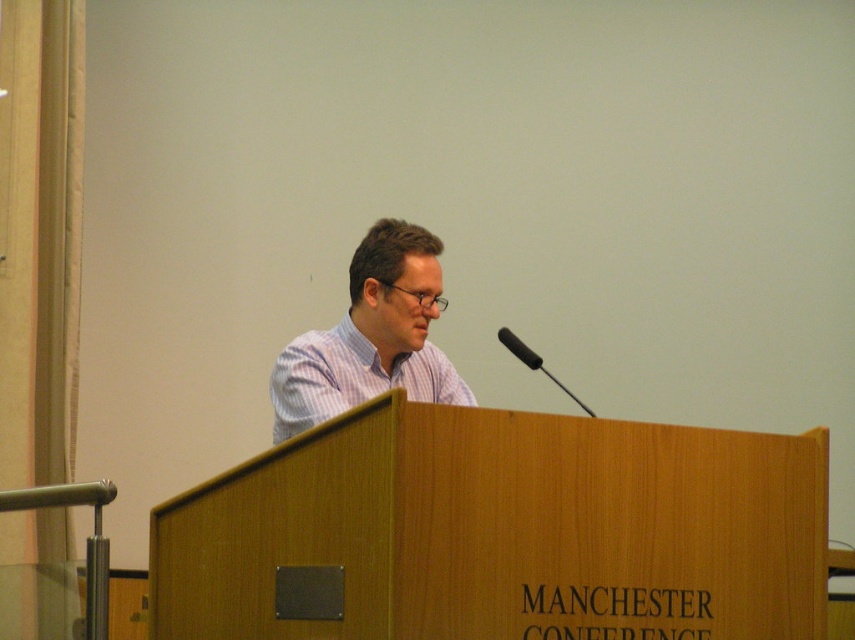
You are an event organizer who needs to ensure that the speaker can be easily seen by the audience. Given the white striped shirt at center and the black matte microphone at center, which object takes up more space in the image?

The black matte microphone at center takes up more space than the white striped shirt at center.

You are a photographer at the Manchester Conference. You need to capture a photo where the white striped shirt at center is clearly visible above the black matte microphone at center. Based on the scene description, will the shirt naturally be visible above the microphone in this setup?

The white striped shirt at center has a greater height compared to the black matte microphone at center, so yes, the shirt will naturally be visible above the microphone in this setup.